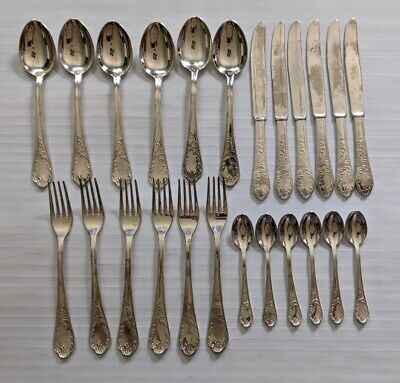
Identify the location of knives. (261, 107), (278, 106), (304, 103), (312, 102), (338, 101), (352, 99).